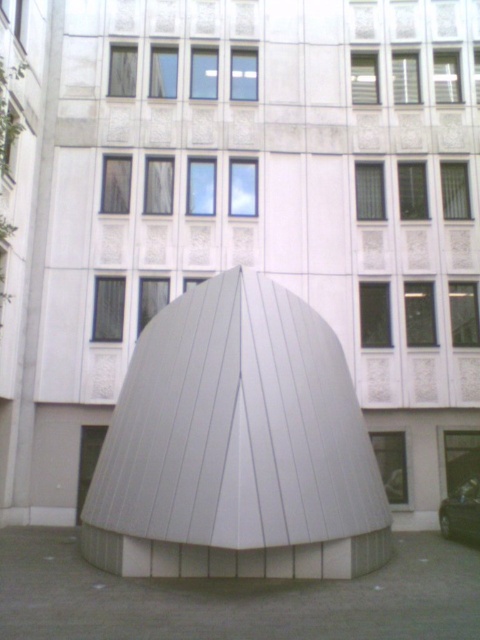
You are standing in front of the modern architectural structure and want to take a photo of both the white smooth dome at center and the shiny black car at lower right. Which object should you adjust your camera angle to include first if you want to capture both in the frame?

The white smooth dome at center is shorter than the shiny black car at lower right, so you should adjust your camera angle to include the shiny black car at lower right first since it is taller and might be partially obscured if not framed properly.

You are a photographer trying to capture the white smooth dome at center and the shiny black car at lower right in the same frame. Based on their sizes, which object should you focus on first to ensure both fit in the frame?

The white smooth dome at center is narrower than the shiny black car at lower right, so you should focus on framing the shiny black car at lower right first to ensure both objects fit in the frame.

You are a delivery person standing next to the shiny black car at lower right. You need to place a package at the base of the white smooth dome at center. Can you walk directly to the dome without any obstacles between you and the dome?

The distance between the shiny black car at lower right and the white smooth dome at center is 7.27 meters. Since there are no obstacles mentioned in the scene description, you can walk directly to the dome.